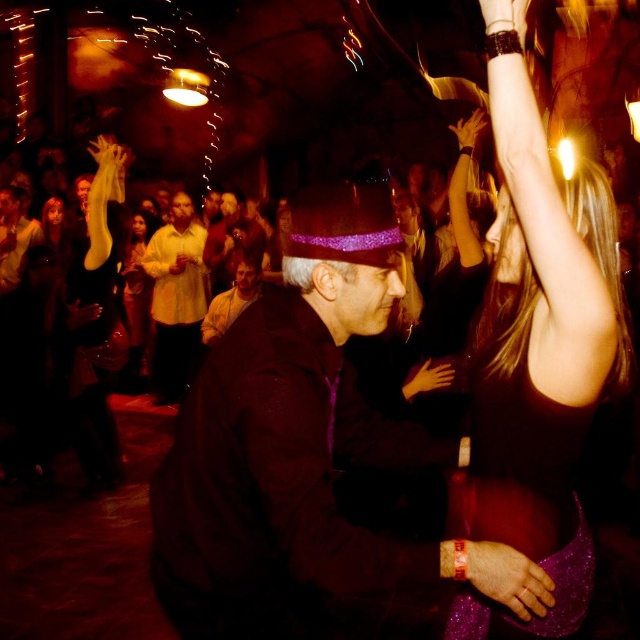
Is light brown leather jacket at center bigger than matte yellow hand at center?

Indeed, light brown leather jacket at center has a larger size compared to matte yellow hand at center.

Is point (204, 337) closer to viewer compared to point (177, 269)?

Yes, it is.

Is point (252, 282) positioned in front of point (176, 262)?

Yes.

Find the location of a particular element. light brown leather jacket at center is located at coordinates (230, 300).

Based on the photo, between light yellow shirt at center and matte yellow dress at center, which one appears on the right side from the viewer's perspective?

Positioned to the right is light yellow shirt at center.

Is point (192, 221) more distant than point (131, 227)?

That is True.

Find the location of a particular element. The height and width of the screenshot is (640, 640). light yellow shirt at center is located at coordinates (176, 298).

Who is more distant from viewer, [289,396] or [484,608]?

The point [484,608] is behind.

Is purple glittery arm at center wider than sparkly purple dress at right?

Yes, purple glittery arm at center is wider than sparkly purple dress at right.

Identify the location of purple glittery arm at center. (333, 499).

The height and width of the screenshot is (640, 640). What are the coordinates of `purple glittery arm at center` in the screenshot? It's located at (333, 499).